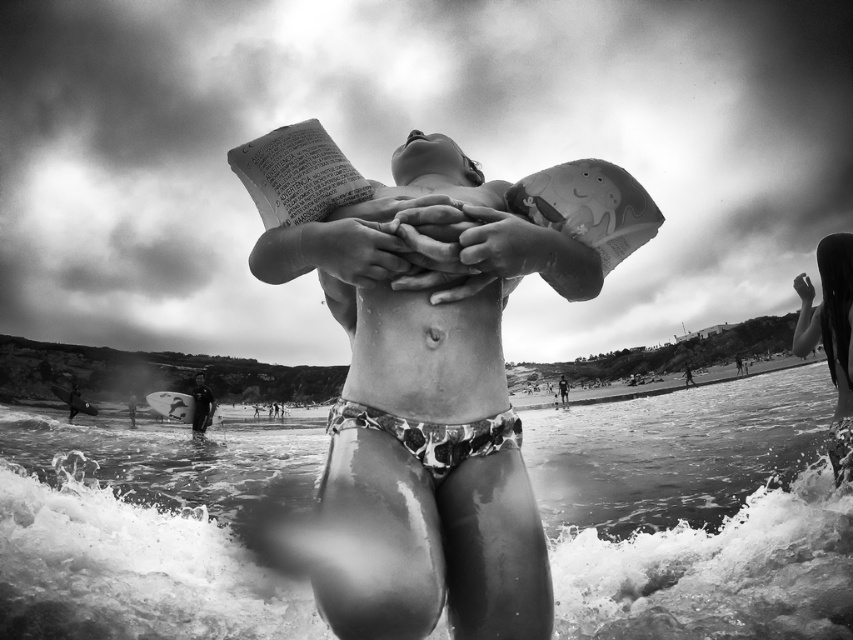
You are a photographer trying to capture a wide shot of the beach scene. The wet sand at lower center and the smooth black wetsuit at lower left are part of the composition. Given their distance apart, will you need to use a wide angle lens to include both in the frame?

The wet sand at lower center and smooth black wetsuit at lower left are 92.22 meters apart. To capture both in the same frame, a wide angle lens would be necessary to accommodate the large distance between them.

You are taking a photo of the beach scene. You want to focus on the person holding the paper first. Which point, point (351, 440) or point (834, 467), is closer to the camera and thus in focus?

Point (351, 440) is closer to the camera than point (834, 467), so it would be in focus first.